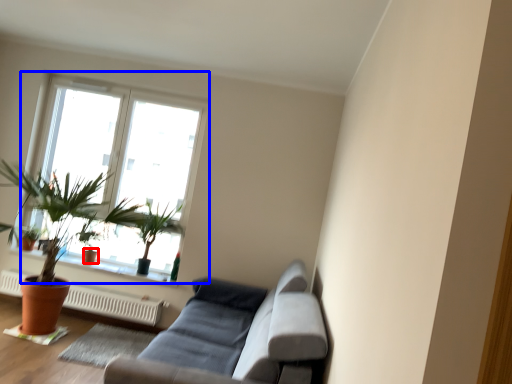
Question: Which point is closer to the camera, flowerpot (highlighted by a red box) or window (highlighted by a blue box)?

Choices:
 (A) flowerpot
 (B) window

Answer: (B)